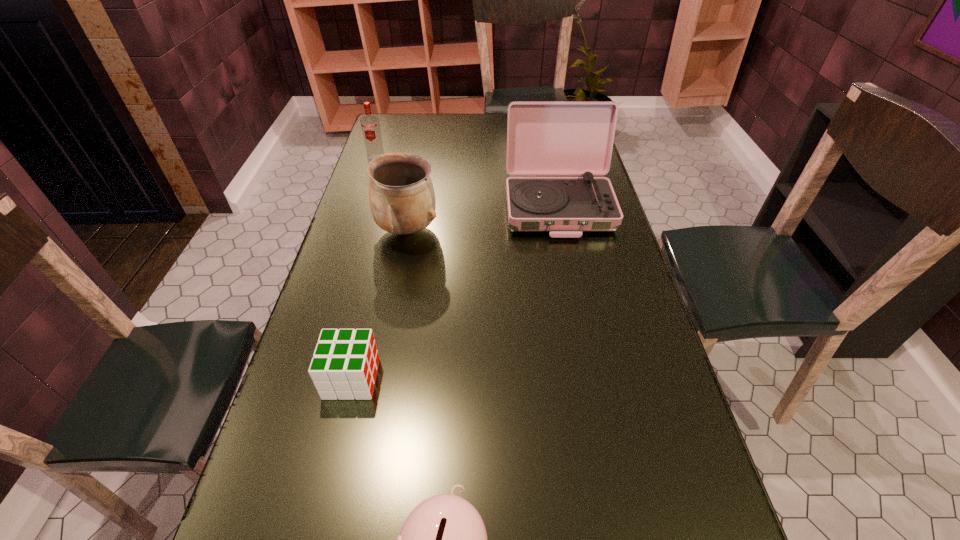
Image resolution: width=960 pixels, height=540 pixels. Find the location of `the tallest object`. the tallest object is located at coordinates (543, 138).

Locate an element on the screen. The width and height of the screenshot is (960, 540). record player is located at coordinates (543, 138).

Where is `urn`? The width and height of the screenshot is (960, 540). urn is located at coordinates (402, 199).

Image resolution: width=960 pixels, height=540 pixels. In order to click on vodka in this screenshot , I will do `click(370, 124)`.

This screenshot has height=540, width=960. In order to click on the farthest object in this screenshot , I will do `click(370, 124)`.

At what (x,y) coordinates should I click in order to perform the action: click on the fourth farthest object. Please return your answer as a coordinate pair (x, y). Image resolution: width=960 pixels, height=540 pixels. Looking at the image, I should click on (344, 365).

At what (x,y) coordinates should I click in order to perform the action: click on cube. Please return your answer as a coordinate pair (x, y). This screenshot has width=960, height=540. Looking at the image, I should click on (344, 365).

You are a GUI agent. You are given a task and a screenshot of the screen. Output one action in this format:
    pyautogui.click(x=<x>, y=<y>)
    Task: Click on the vacant space located 0.310m with the lid open on the tallest object
    Image resolution: width=960 pixels, height=540 pixels.
    Given the screenshot: What is the action you would take?
    pyautogui.click(x=583, y=325)

Locate an element on the screen. This screenshot has width=960, height=540. vacant space located 0.320m on the right of the urn is located at coordinates (547, 230).

Image resolution: width=960 pixels, height=540 pixels. What are the coordinates of `vacant space located 0.360m on the front label of the leftmost object` in the screenshot? It's located at (355, 226).